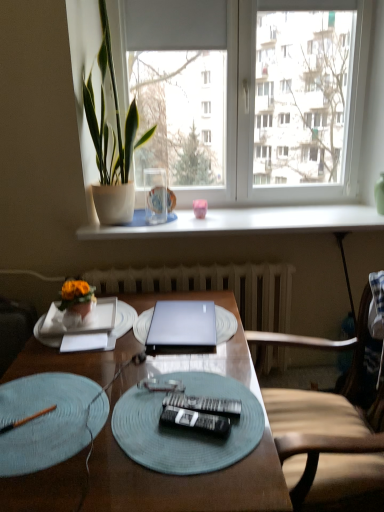
Find the location of `vacant space in front of pink matte coffee cup at center`. vacant space in front of pink matte coffee cup at center is located at coordinates (207, 226).